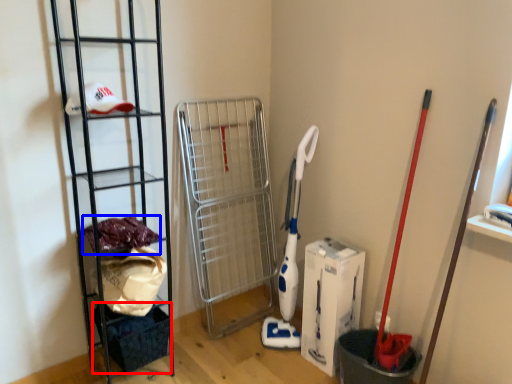
Question: Which object appears farthest to the camera in this image, basket (highlighted by a red box) or material (highlighted by a blue box)?

Choices:
 (A) basket
 (B) material

Answer: (A)